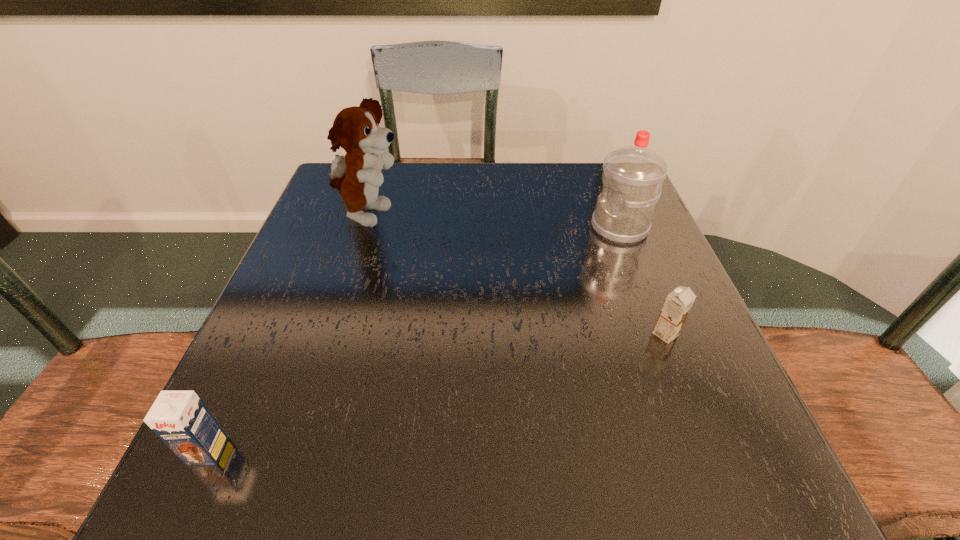
Locate an element on the screen. The image size is (960, 540). the third object from right to left is located at coordinates (357, 175).

Identify the location of the second tallest object. (632, 177).

The height and width of the screenshot is (540, 960). In order to click on the left chocolate milk in this screenshot , I will do `click(181, 420)`.

At what (x,y) coordinates should I click in order to perform the action: click on the nearer chocolate milk. Please return your answer as a coordinate pair (x, y). This screenshot has width=960, height=540. Looking at the image, I should click on (181, 420).

I want to click on the shorter chocolate milk, so click(x=676, y=308).

I want to click on the right chocolate milk, so click(x=676, y=308).

This screenshot has width=960, height=540. What are the coordinates of `free point located 0.090m on the face of the second object from left to right` in the screenshot? It's located at (444, 217).

I want to click on free space located 0.340m on the handle side of the water bottle, so click(x=442, y=228).

Locate an element on the screen. The height and width of the screenshot is (540, 960). free space located 0.260m on the handle side of the water bottle is located at coordinates point(476,228).

At what (x,y) coordinates should I click in order to perform the action: click on free location located on the handle side of the water bottle. Please return your answer as a coordinate pair (x, y). The height and width of the screenshot is (540, 960). Looking at the image, I should click on (468, 228).